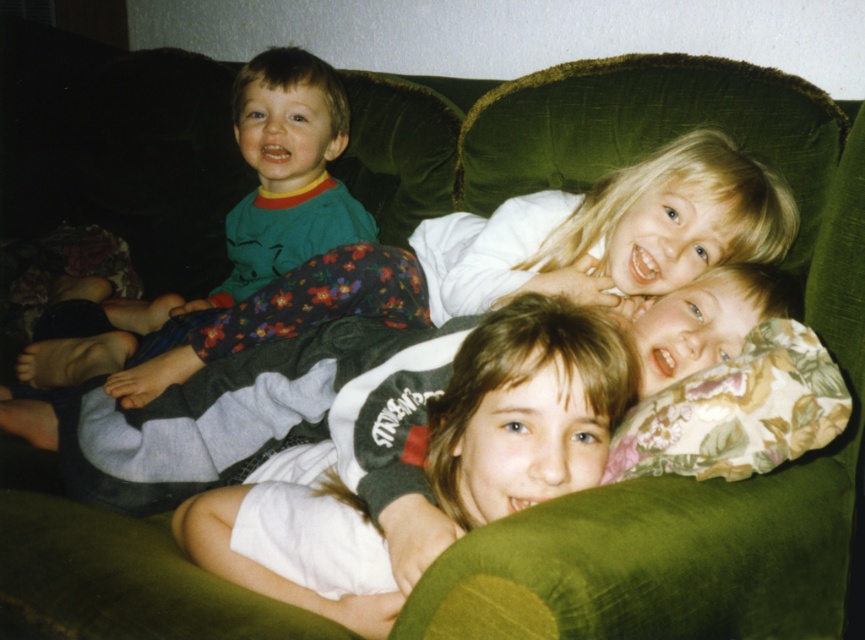
Question: Does floral pajama pants at upper center appear on the left side of floral fabric pillow at lower right?

Choices:
 (A) yes
 (B) no

Answer: (A)

Question: Can you confirm if floral pajama pants at upper center is positioned to the right of matte green pajamas at left?

Choices:
 (A) yes
 (B) no

Answer: (A)

Question: Which point appears closest to the camera in this image?

Choices:
 (A) (110, 374)
 (B) (266, 259)

Answer: (A)

Question: Is floral fabric pillow at lower right smaller than matte green pajamas at left?

Choices:
 (A) yes
 (B) no

Answer: (A)

Question: Which object is closer to the camera taking this photo?

Choices:
 (A) floral pajama pants at upper center
 (B) green soft pajamas at left
 (C) floral fabric pillow at lower right

Answer: (C)

Question: Which of the following is the farthest from the observer?

Choices:
 (A) green soft pajamas at left
 (B) matte green pajamas at left

Answer: (B)